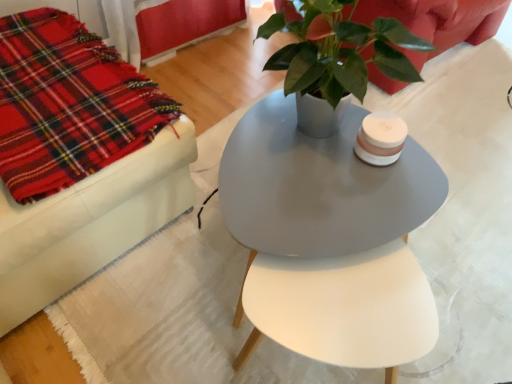
This screenshot has width=512, height=384. Find the location of `spots to the right of matte gray table at center`. spots to the right of matte gray table at center is located at coordinates (470, 246).